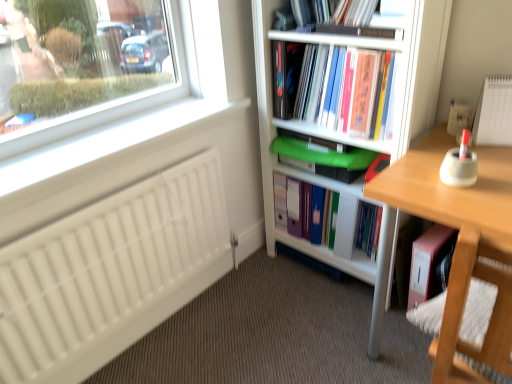
Question: From the image's perspective, is green plastic folder at center, which ranks as the 2th book in bottom-to-top order, above wooden desk at right?

Choices:
 (A) yes
 (B) no

Answer: (A)

Question: Would you say green plastic folder at center, the fourth book from the top, contains wooden desk at right?

Choices:
 (A) yes
 (B) no

Answer: (B)

Question: Does green plastic folder at center, the fourth book from the top, have a lesser height compared to wooden desk at right?

Choices:
 (A) yes
 (B) no

Answer: (A)

Question: From the image's perspective, is green plastic folder at center, which ranks as the 2th book in bottom-to-top order, under wooden desk at right?

Choices:
 (A) yes
 (B) no

Answer: (B)

Question: Is green plastic folder at center, the fourth book from the top, located outside wooden desk at right?

Choices:
 (A) no
 (B) yes

Answer: (B)

Question: Considering the relative positions of green plastic folder at center, which ranks as the 2th book in bottom-to-top order, and hardcover book at center, positioned as the 4th book in bottom-to-top order, in the image provided, is green plastic folder at center, which ranks as the 2th book in bottom-to-top order, to the left or to the right of hardcover book at center, positioned as the 4th book in bottom-to-top order,?

Choices:
 (A) left
 (B) right

Answer: (A)

Question: Based on their sizes in the image, would you say green plastic folder at center, the fourth book from the top, is bigger or smaller than hardcover book at center, the 2th book viewed from the top?

Choices:
 (A) big
 (B) small

Answer: (B)

Question: From the image's perspective, is green plastic folder at center, the fourth book from the top, positioned above or below hardcover book at center, positioned as the 4th book in bottom-to-top order?

Choices:
 (A) above
 (B) below

Answer: (B)

Question: Relative to hardcover book at center, the 2th book viewed from the top, is green plastic folder at center, which ranks as the 2th book in bottom-to-top order, in front or behind?

Choices:
 (A) behind
 (B) front

Answer: (A)

Question: Choose the correct answer: Is pink matte folder at lower right, placed as the 1th book when sorted from bottom to top, inside wooden swivel chair at lower right or outside it?

Choices:
 (A) inside
 (B) outside

Answer: (B)

Question: Considering the positions of pink matte folder at lower right, placed as the 1th book when sorted from bottom to top, and wooden swivel chair at lower right in the image, is pink matte folder at lower right, placed as the 1th book when sorted from bottom to top, bigger or smaller than wooden swivel chair at lower right?

Choices:
 (A) big
 (B) small

Answer: (B)

Question: Considering the positions of pink matte folder at lower right, the fifth book viewed from the top, and wooden swivel chair at lower right in the image, is pink matte folder at lower right, the fifth book viewed from the top, wider or thinner than wooden swivel chair at lower right?

Choices:
 (A) thin
 (B) wide

Answer: (A)

Question: Is pink matte folder at lower right, placed as the 1th book when sorted from bottom to top, in front of or behind wooden swivel chair at lower right in the image?

Choices:
 (A) front
 (B) behind

Answer: (B)

Question: Would you say wooden swivel chair at lower right is to the left or to the right of pink matte folder at lower right, placed as the 1th book when sorted from bottom to top, in the picture?

Choices:
 (A) right
 (B) left

Answer: (B)

Question: Is point 458,362 positioned closer to the camera than point 442,254?

Choices:
 (A) closer
 (B) farther

Answer: (A)